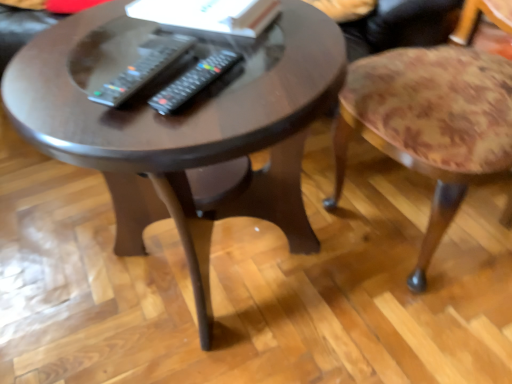
Where is `free point in front of black plastic remote at center, which appears as the 1th remote when viewed from the left`? Image resolution: width=512 pixels, height=384 pixels. free point in front of black plastic remote at center, which appears as the 1th remote when viewed from the left is located at coordinates (143, 129).